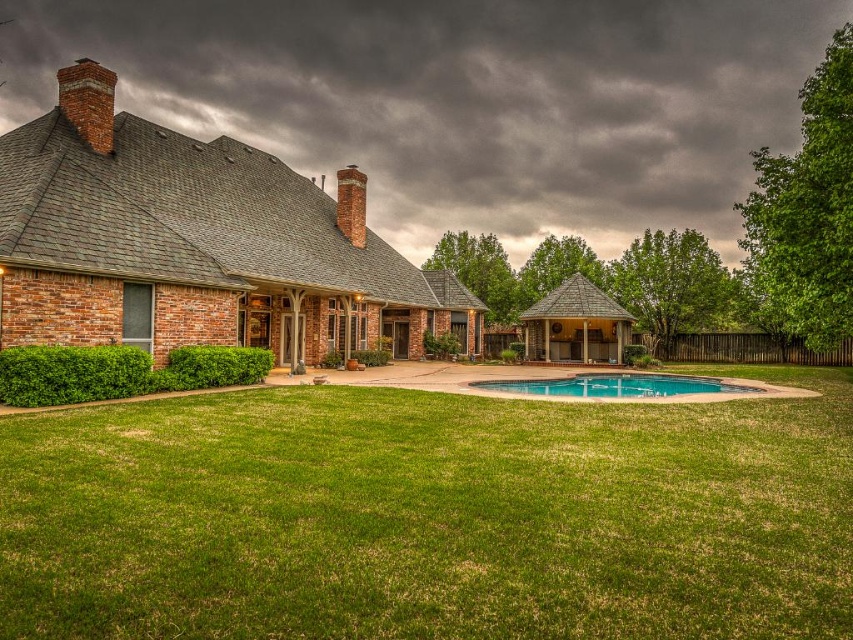
You are standing in the backyard of the house and want to locate the brick chimney at upper center. According to the scene, where would you find it in relation to the dark gray shingles at upper center?

The brick chimney at upper center is located below the dark gray shingles at upper center since the dark gray shingles are above it.

You are standing in the backyard of the house looking towards the roof. Which object, the dark gray shingles at upper center or the brick chimney at upper center, is closer to you?

The dark gray shingles at upper center are closer to you because the brick chimney at upper center is behind them.